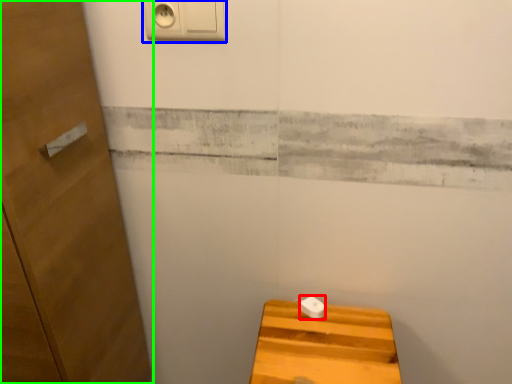
Question: Which object is positioned closest to knob (highlighted by a red box)? Select from light switch (highlighted by a blue box) and door (highlighted by a green box).

Choices:
 (A) light switch
 (B) door

Answer: (B)